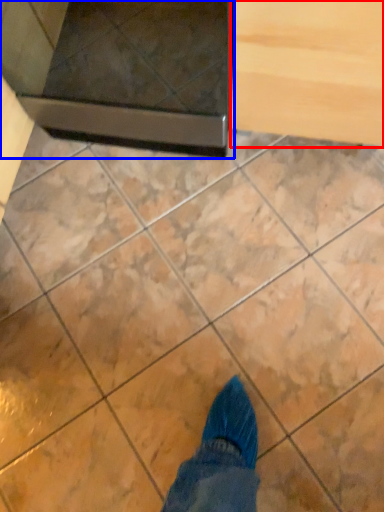
Question: Which object is further to the camera taking this photo, drawer (highlighted by a red box) or appliance (highlighted by a blue box)?

Choices:
 (A) drawer
 (B) appliance

Answer: (B)